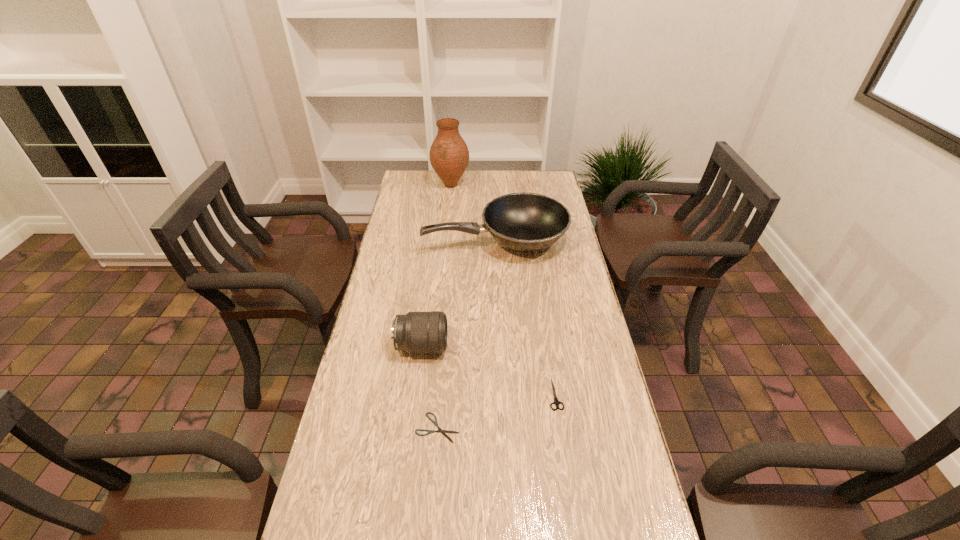
Locate an element on the screen. The width and height of the screenshot is (960, 540). vacant space located 0.100m on the surface of the third nearest object is located at coordinates (480, 346).

Locate an element on the screen. vacant area located 0.220m on the left of the fourth farthest object is located at coordinates (468, 394).

The image size is (960, 540). Identify the location of blank area located on the back of the left shears. (443, 369).

You are a GUI agent. You are given a task and a screenshot of the screen. Output one action in this format:
    pyautogui.click(x=<x>, y=<y>)
    Task: Click on the object at the far edge
    
    Given the screenshot: What is the action you would take?
    pyautogui.click(x=449, y=156)

This screenshot has height=540, width=960. I want to click on vase present at the left edge, so [x=449, y=156].

I want to click on frying pan located in the left edge section of the desktop, so click(526, 222).

The width and height of the screenshot is (960, 540). Find the location of `telephoto lens situated at the left edge`. telephoto lens situated at the left edge is located at coordinates (416, 332).

The image size is (960, 540). I want to click on frying pan located at the right edge, so click(x=526, y=222).

I want to click on shears that is at the right edge, so click(x=556, y=401).

This screenshot has height=540, width=960. I want to click on object located in the far left corner section of the desktop, so click(x=449, y=156).